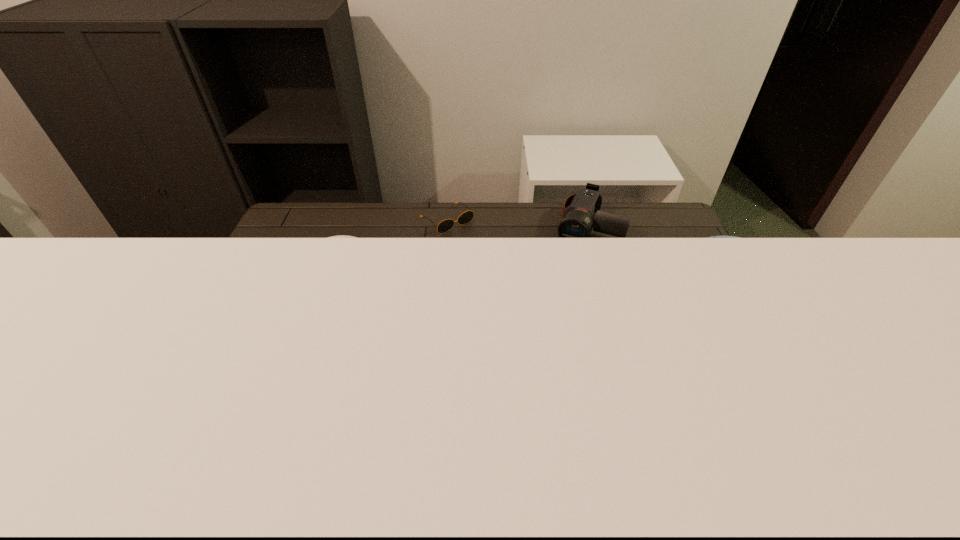
Identify the location of free space between the left soccer ball and the second object from left to right. Image resolution: width=960 pixels, height=540 pixels. (400, 270).

Where is `free space that is in between the shortest object and the right soccer ball`? free space that is in between the shortest object and the right soccer ball is located at coordinates (575, 271).

Image resolution: width=960 pixels, height=540 pixels. What are the coordinates of `empty space between the third tallest object and the right soccer ball` in the screenshot? It's located at (644, 273).

I want to click on vacant area that lies between the second object from left to right and the second shortest object, so click(x=516, y=222).

Where is `free space between the right soccer ball and the shortest object`? The image size is (960, 540). free space between the right soccer ball and the shortest object is located at coordinates [575, 271].

Select which object is the closest to the camcorder. Please provide its 2D coordinates. Your answer should be formatted as a tuple, i.e. [(x, y)], where the tuple contains the x and y coordinates of a point satisfying the conditions above.

[(712, 236)]

Identify which object is located as the second nearest to the sunglasses. Please provide its 2D coordinates. Your answer should be formatted as a tuple, i.e. [(x, y)], where the tuple contains the x and y coordinates of a point satisfying the conditions above.

[(578, 221)]

Find the location of a particular element. Image resolution: width=960 pixels, height=540 pixels. free space that satisfies the following two spatial constraints: 1. on the back side of the second shortest object; 2. on the right side of the left soccer ball is located at coordinates (379, 225).

The height and width of the screenshot is (540, 960). Identify the location of free point that satisfies the following two spatial constraints: 1. on the front side of the leftmost object; 2. on the side with brand of the right soccer ball. (353, 321).

Where is `free space that satisfies the following two spatial constraints: 1. on the front side of the camcorder; 2. on the side with brand of the right soccer ball`? free space that satisfies the following two spatial constraints: 1. on the front side of the camcorder; 2. on the side with brand of the right soccer ball is located at coordinates (613, 321).